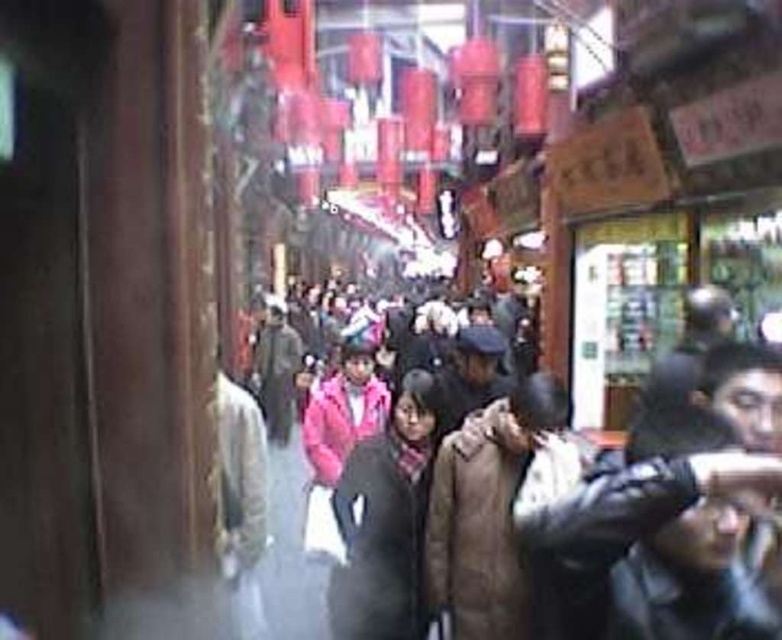
Question: Is brown down jacket at center below dark gray fur coat at center?

Choices:
 (A) yes
 (B) no

Answer: (B)

Question: Which point is farther from the camera taking this photo?

Choices:
 (A) (493, 572)
 (B) (605, 506)
 (C) (407, 632)

Answer: (C)

Question: Is dark brown down jacket at center smaller than brown down jacket at center?

Choices:
 (A) yes
 (B) no

Answer: (B)

Question: In this image, where is dark brown down jacket at center located relative to dark gray fur coat at center?

Choices:
 (A) left
 (B) right

Answer: (B)

Question: Which of the following is the farthest from the observer?

Choices:
 (A) (458, 621)
 (B) (470, 525)

Answer: (A)

Question: Estimate the real-world distances between objects in this image. Which object is closer to the dark brown down jacket at center?

Choices:
 (A) brown down jacket at center
 (B) dark gray fur coat at center

Answer: (A)